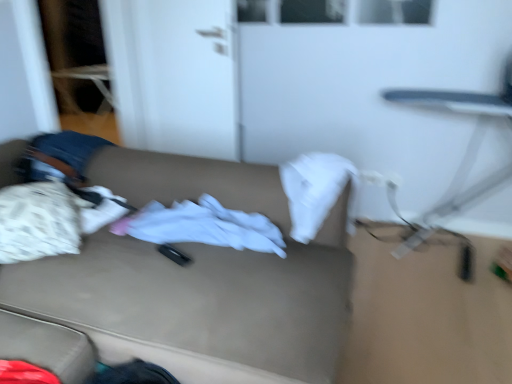
You are a GUI agent. You are given a task and a screenshot of the screen. Output one action in this format:
    pyautogui.click(x=<x>, y=<y>)
    Task: Click on the beige fabric couch at center
    The image size is (512, 384).
    Given the screenshot: What is the action you would take?
    pyautogui.click(x=201, y=277)

At what (x,y) coordinates should I click in order to perform the action: click on beige fabric couch at center. Please return your answer as a coordinate pair (x, y). Image resolution: width=512 pixels, height=384 pixels. Looking at the image, I should click on tap(201, 277).

Based on the photo, is beige fabric couch at center positioned beyond the bounds of metallic silver swivel chair at right?

Yes, beige fabric couch at center is not within metallic silver swivel chair at right.

Based on the photo, which point is more forward, (148, 268) or (421, 217)?

The point (148, 268) is closer to the camera.

Which object is further away from the camera, beige fabric couch at center or metallic silver swivel chair at right?

metallic silver swivel chair at right is more distant.

From the image's perspective, relative to metallic silver swivel chair at right, is beige fabric couch at center above or below?

beige fabric couch at center is situated lower than metallic silver swivel chair at right in the image.

Is metallic silver swivel chair at right positioned with its back to beige fabric couch at center?

metallic silver swivel chair at right does not have its back to beige fabric couch at center.

Is metallic silver swivel chair at right closer to camera compared to beige fabric couch at center?

That is False.

Which point is more distant from viewer, (410,238) or (191,250)?

The point (410,238) is farther from the camera.

Considering the sizes of objects metallic silver swivel chair at right and beige fabric couch at center in the image provided, who is wider, metallic silver swivel chair at right or beige fabric couch at center?

With larger width is beige fabric couch at center.

Which of these two, white matte door at upper left or metallic silver swivel chair at right, is wider?

With larger width is metallic silver swivel chair at right.

Between white matte door at upper left and metallic silver swivel chair at right, which one has less height?

Standing shorter between the two is metallic silver swivel chair at right.

From the image's perspective, is white matte door at upper left beneath metallic silver swivel chair at right?

Incorrect, from the image's perspective, white matte door at upper left is higher than metallic silver swivel chair at right.

Could you tell me if white matte door at upper left is facing metallic silver swivel chair at right?

No, white matte door at upper left is not oriented towards metallic silver swivel chair at right.

In the image, is white soft cloth at center positioned in front of or behind metallic silver swivel chair at right?

In the image, white soft cloth at center appears in front of metallic silver swivel chair at right.

Based on their sizes in the image, would you say white soft cloth at center is bigger or smaller than metallic silver swivel chair at right?

white soft cloth at center is smaller than metallic silver swivel chair at right.

Does white soft cloth at center touch metallic silver swivel chair at right?

No, white soft cloth at center is not in contact with metallic silver swivel chair at right.

Is white soft cloth at center situated inside beige fabric couch at center or outside?

white soft cloth at center lies within the bounds of beige fabric couch at center.

From a real-world perspective, who is located higher, white soft cloth at center or beige fabric couch at center?

white soft cloth at center is physically above.

From the image's perspective, between white soft cloth at center and beige fabric couch at center, who is located below?

beige fabric couch at center, from the image's perspective.

From a real-world perspective, relative to white soft cloth at center, is beige fabric couch at center vertically above or below?

beige fabric couch at center is below white soft cloth at center.

From the image's perspective, would you say beige fabric couch at center is positioned over white soft cloth at center?

No.

How far apart are beige fabric couch at center and white soft cloth at center?

6.61 inches.

Considering the relative positions of beige fabric couch at center and white soft cloth at center in the image provided, is beige fabric couch at center to the left of white soft cloth at center from the viewer's perspective?

Yes.

From a real-world perspective, which object rests below the other?

From a 3D spatial view, beige fabric couch at center is below.

Is white matte door at upper left positioned with its back to beige fabric couch at center?

white matte door at upper left is not turned away from beige fabric couch at center.

Considering the relative sizes of white matte door at upper left and beige fabric couch at center in the image provided, is white matte door at upper left smaller than beige fabric couch at center?

Yes.

Is white matte door at upper left spatially inside beige fabric couch at center, or outside of it?

white matte door at upper left is located beyond the bounds of beige fabric couch at center.

Identify the location of studio couch below the metallic silver swivel chair at right (from the image's perspective). (201, 277).

The image size is (512, 384). In order to click on swivel chair that is on the right side of beige fabric couch at center in this screenshot , I will do `click(465, 154)`.

Based on their spatial positions, is beige fabric couch at center or metallic silver swivel chair at right closer to white matte door at upper left?

beige fabric couch at center is closer to white matte door at upper left.

Based on their spatial positions, is white matte door at upper left or beige fabric couch at center further from metallic silver swivel chair at right?

The object further to metallic silver swivel chair at right is beige fabric couch at center.

When comparing their distances from white matte door at upper left, does metallic silver swivel chair at right or beige fabric couch at center seem closer?

beige fabric couch at center is positioned closer to the anchor white matte door at upper left.

Which object lies nearer to the anchor point beige fabric couch at center, white soft cloth at center or metallic silver swivel chair at right?

The object closer to beige fabric couch at center is white soft cloth at center.

Looking at the image, which one is located further to white soft cloth at center, white matte door at upper left or beige fabric couch at center?

The object further to white soft cloth at center is white matte door at upper left.

From the image, which object appears to be nearer to beige fabric couch at center, white matte door at upper left or white soft cloth at center?

The object closer to beige fabric couch at center is white soft cloth at center.

From the image, which object appears to be nearer to white soft cloth at center, white matte door at upper left or metallic silver swivel chair at right?

The object closer to white soft cloth at center is white matte door at upper left.

Which object lies further to the anchor point metallic silver swivel chair at right, beige fabric couch at center or white soft cloth at center?

beige fabric couch at center is positioned further to the anchor metallic silver swivel chair at right.

The image size is (512, 384). Find the location of `baby clothe between beige fabric couch at center and metallic silver swivel chair at right in the horizontal direction`. baby clothe between beige fabric couch at center and metallic silver swivel chair at right in the horizontal direction is located at coordinates (202, 226).

Locate an element on the screen. This screenshot has height=384, width=512. baby clothe situated between white matte door at upper left and metallic silver swivel chair at right from left to right is located at coordinates (202, 226).

Where is `studio couch between white matte door at upper left and metallic silver swivel chair at right in the horizontal direction`? studio couch between white matte door at upper left and metallic silver swivel chair at right in the horizontal direction is located at coordinates (201, 277).

At what (x,y) coordinates should I click in order to perform the action: click on baby clothe between beige fabric couch at center and white matte door at upper left in the front-back direction. Please return your answer as a coordinate pair (x, y). This screenshot has height=384, width=512. Looking at the image, I should click on (202, 226).